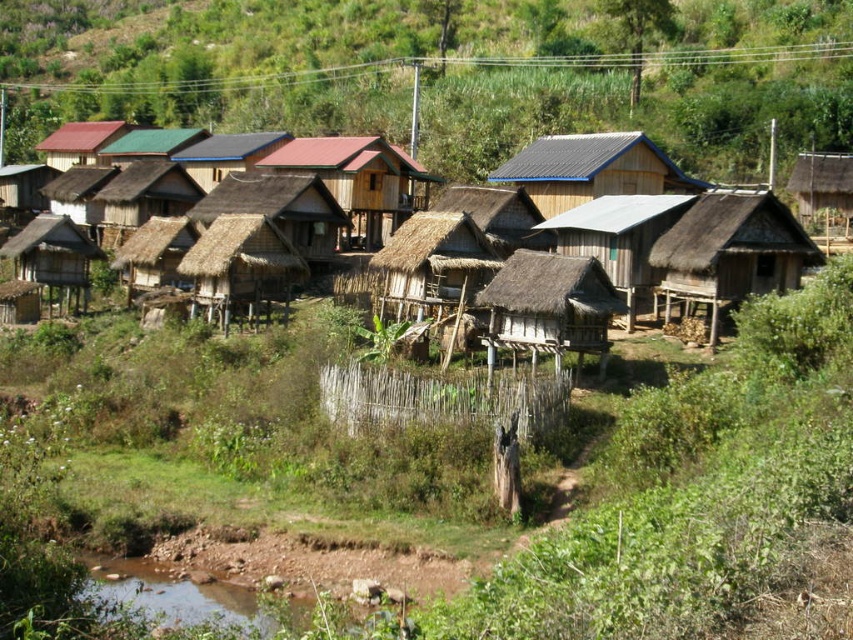
Find the location of a particular element. matte blue wood hut at center is located at coordinates (590, 170).

This screenshot has height=640, width=853. Describe the element at coordinates (590, 170) in the screenshot. I see `matte blue wood hut at center` at that location.

The height and width of the screenshot is (640, 853). In order to click on matte blue wood hut at center in this screenshot , I will do `click(590, 170)`.

Who is positioned more to the left, matte blue wood hut at center or thatched wood hut at left?

thatched wood hut at left

Does point (553, 154) come in front of point (59, 218)?

No, it is behind (59, 218).

What are the coordinates of `matte blue wood hut at center` in the screenshot? It's located at (590, 170).

Between point (251, 234) and point (608, 225), which one is positioned in front?

Point (608, 225)

Consider the image. Between brown thatch hut at center and brown thatched hut at center, which one has less height?

brown thatch hut at center

Does point (225, 266) come closer to viewer compared to point (651, 228)?

Yes, it is in front of point (651, 228).

Locate an element on the screen. The image size is (853, 640). brown thatch hut at center is located at coordinates (241, 266).